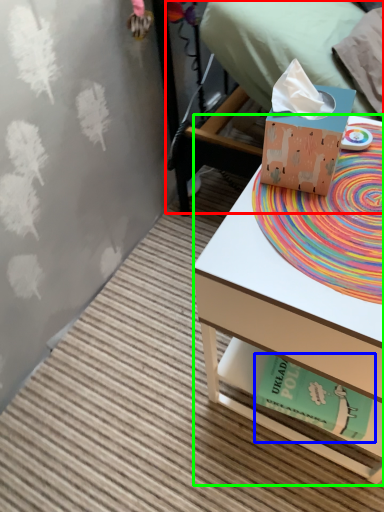
Question: Estimate the real-world distances between objects in this image. Which object is farther from bed (highlighted by a red box), paperback book (highlighted by a blue box) or desk (highlighted by a green box)?

Choices:
 (A) paperback book
 (B) desk

Answer: (A)